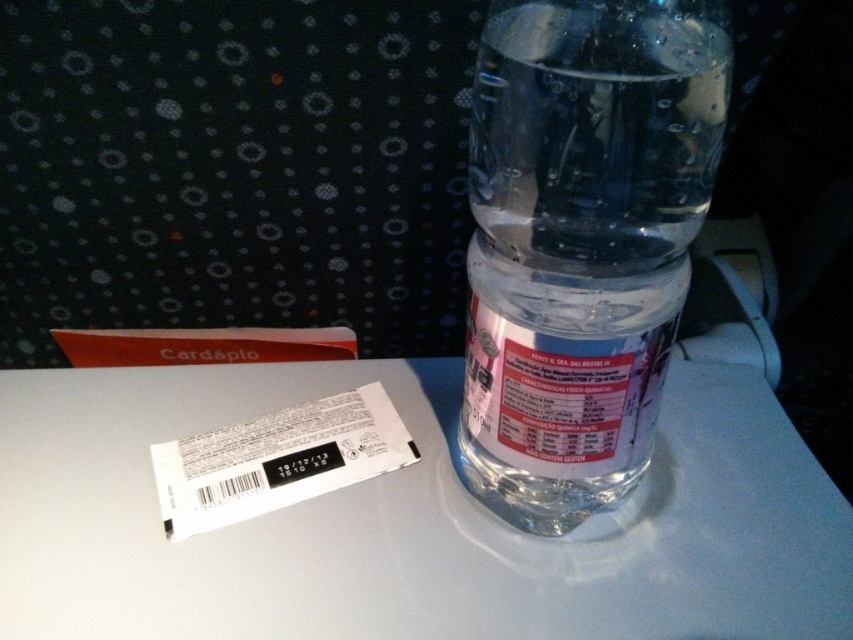
Question: Among these points, which one is farthest from the camera?

Choices:
 (A) 238,628
 (B) 619,413

Answer: (A)

Question: Is clear plastic bottle at center above transparent plastic bottle at center?

Choices:
 (A) yes
 (B) no

Answer: (B)

Question: Is clear plastic bottle at center in front of transparent plastic bottle at center?

Choices:
 (A) no
 (B) yes

Answer: (A)

Question: Which point appears closest to the camera in this image?

Choices:
 (A) (715, 33)
 (B) (402, 589)

Answer: (A)

Question: Can you confirm if clear plastic bottle at center is thinner than transparent plastic bottle at center?

Choices:
 (A) yes
 (B) no

Answer: (B)